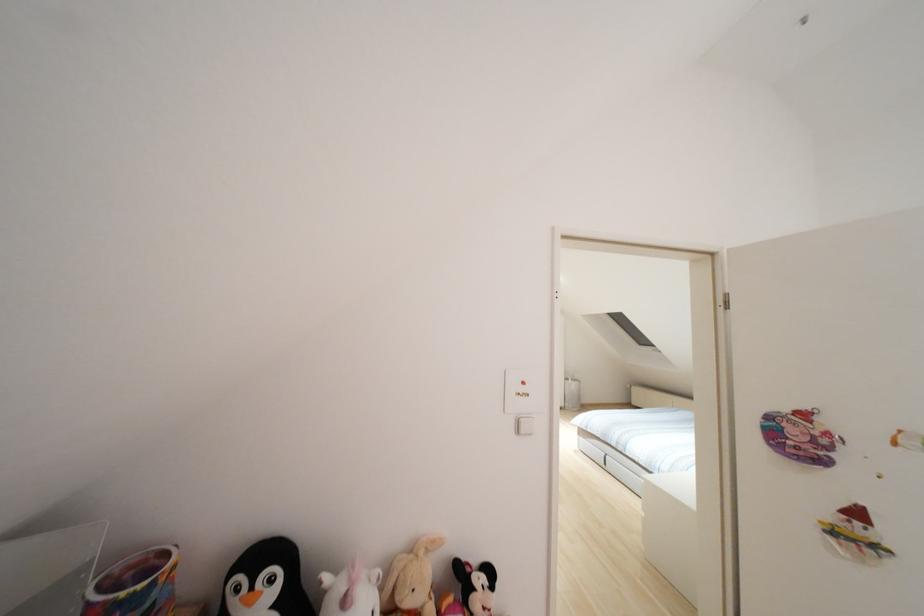
Locate an element on the screen. The width and height of the screenshot is (924, 616). white light switch is located at coordinates (524, 427).